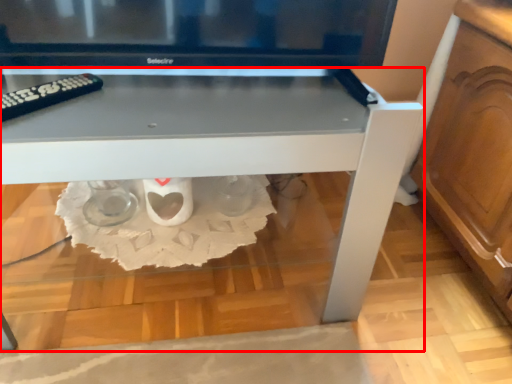
Question: Observing the image, what is the correct spatial positioning of table (annotated by the red box) in reference to remote?

Choices:
 (A) left
 (B) right

Answer: (B)